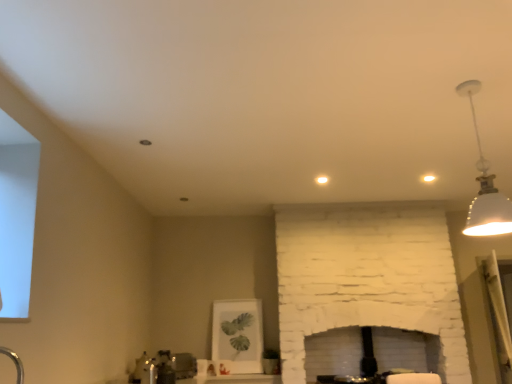
Question: Is white glossy sink at lower center in front of or behind satin nickel faucet at lower center in the image?

Choices:
 (A) behind
 (B) front

Answer: (A)

Question: From the image's perspective, is white glossy sink at lower center positioned above or below satin nickel faucet at lower center?

Choices:
 (A) below
 (B) above

Answer: (A)

Question: Estimate the real-world distances between objects in this image. Which object is farther from the white matte pendant light at upper right?

Choices:
 (A) satin nickel faucet at lower center
 (B) white glossy sink at lower center

Answer: (B)

Question: Estimate the real-world distances between objects in this image. Which object is closer to the white matte pendant light at upper right?

Choices:
 (A) white glossy sink at lower center
 (B) satin nickel faucet at lower center

Answer: (B)